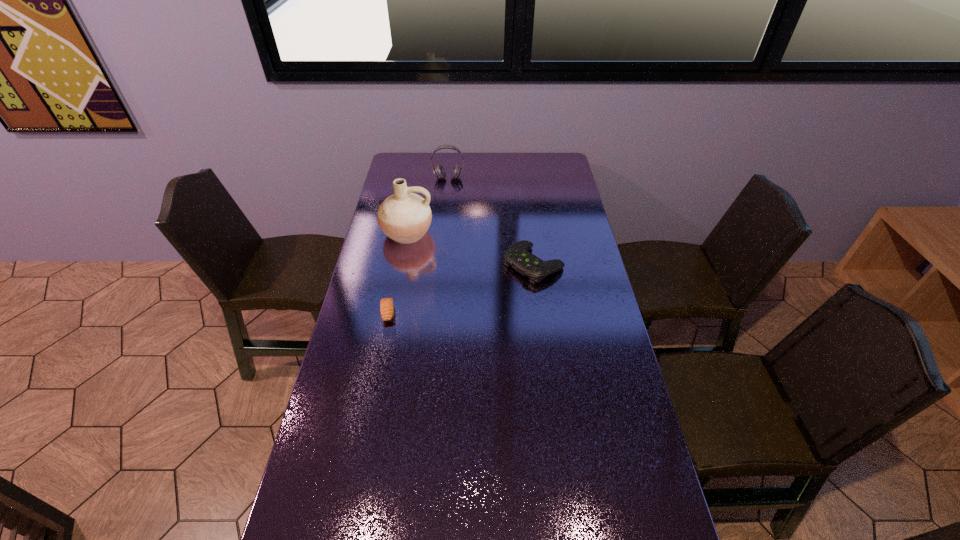
Image resolution: width=960 pixels, height=540 pixels. In order to click on vacant space situated on the front of the nearest object in this screenshot , I will do `click(381, 350)`.

Find the location of `object that is at the far edge`. object that is at the far edge is located at coordinates (439, 172).

Locate an element on the screen. This screenshot has height=540, width=960. pottery that is at the left edge is located at coordinates (404, 217).

Image resolution: width=960 pixels, height=540 pixels. Find the location of `sushi that is positioned at the left edge`. sushi that is positioned at the left edge is located at coordinates (386, 304).

Where is `object present at the right edge`? object present at the right edge is located at coordinates (518, 256).

What are the coordinates of `free space at the left edge of the desktop` in the screenshot? It's located at (312, 461).

This screenshot has width=960, height=540. I want to click on vacant area at the right edge, so click(577, 240).

Image resolution: width=960 pixels, height=540 pixels. Find the location of `vacant space at the far left corner`. vacant space at the far left corner is located at coordinates (417, 161).

Locate an element on the screen. The height and width of the screenshot is (540, 960). vacant space at the far right corner is located at coordinates (557, 177).

This screenshot has width=960, height=540. What are the coordinates of `empty space between the second shortest object and the sushi` in the screenshot? It's located at (461, 288).